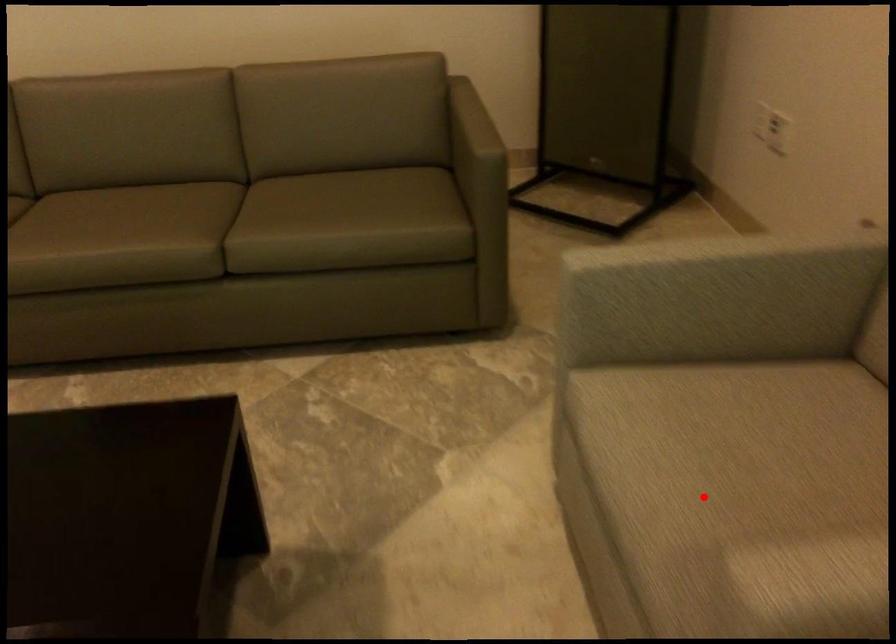
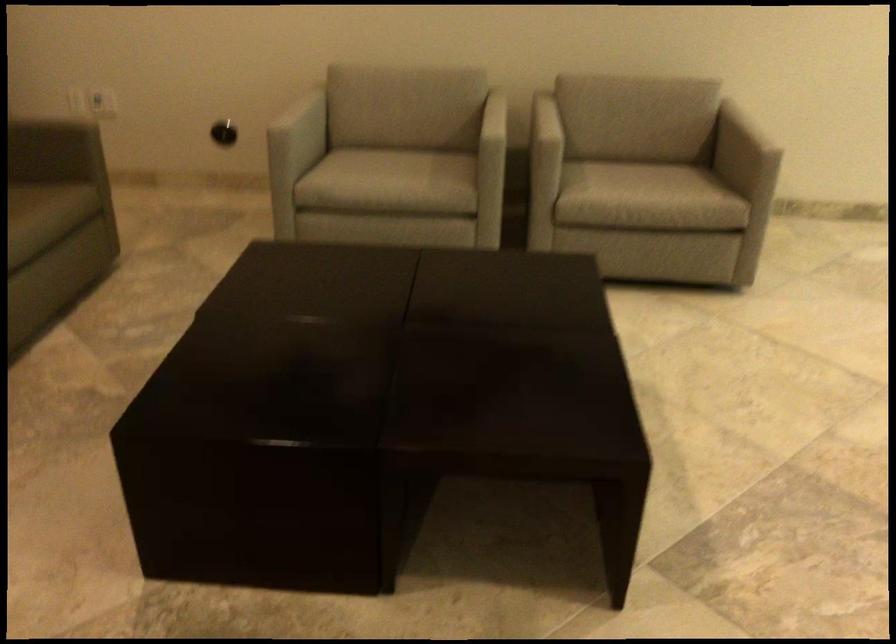
Question: I am providing you with two images of the same scene from different viewpoints. Given a red point in image1, look at the same physical point in image2. Is it:

Choices:
 (A) Closer to the viewpoint
 (B) Farther from the viewpoint

Answer: (B)